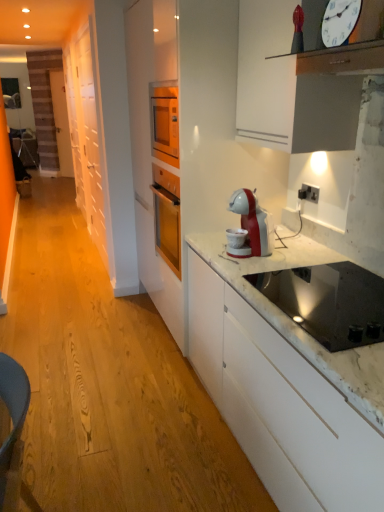
What do you see at coordinates (309, 193) in the screenshot? I see `white plastic electric outlet at upper right` at bounding box center [309, 193].

Measure the distance between point (341, 307) and camera.

Point (341, 307) and camera are 4.82 feet apart.

In the scene shown: In order to face black glass cooktop at lower right, should I rotate leftwards or rightwards?

Rotate your view right by about 19.422°.

This screenshot has width=384, height=512. I want to click on white matte cabinet at left, so click(x=86, y=134).

Are white matte cabinet at left and white plastic clock at upper right located far from each other?

Yes, white matte cabinet at left is far from white plastic clock at upper right.

Do you think white matte cabinet at left is within white plastic clock at upper right, or outside of it?

white matte cabinet at left cannot be found inside white plastic clock at upper right.

Considering the sizes of objects white matte cabinet at left and white plastic clock at upper right in the image provided, who is wider, white matte cabinet at left or white plastic clock at upper right?

Wider between the two is white matte cabinet at left.

Can you confirm if white matte cabinet at left is positioned to the right of white plastic clock at upper right?

No, white matte cabinet at left is not to the right of white plastic clock at upper right.

Is white plastic electric outlet at upper right at the back of white matte cabinet at left?

That's not correct — white matte cabinet at left is not looking away from white plastic electric outlet at upper right.

From a real-world perspective, does white matte cabinet at left stand above white plastic electric outlet at upper right?

Actually, white matte cabinet at left is physically below white plastic electric outlet at upper right in the real world.

Can you tell me how much white matte cabinet at left and white plastic electric outlet at upper right differ in facing direction?

The angular difference between white matte cabinet at left and white plastic electric outlet at upper right is 14.1 degrees.

From a real-world perspective, is white plastic electric outlet at upper right above or below black glass cooktop at lower right?

From a real-world perspective, white plastic electric outlet at upper right is physically above black glass cooktop at lower right.

Identify the location of electric outlet that is on the right side of black glass cooktop at lower right. (309, 193).

Considering the points (314, 194) and (284, 302), which point is behind, point (314, 194) or point (284, 302)?

Positioned behind is point (314, 194).

From the image's perspective, would you say white plastic clock at upper right is positioned over white plastic electric outlet at upper right?

Indeed, from the image's perspective, white plastic clock at upper right is shown above white plastic electric outlet at upper right.

Which is more to the right, white plastic clock at upper right or white plastic electric outlet at upper right?

Positioned to the right is white plastic electric outlet at upper right.

Considering the sizes of white plastic clock at upper right and white plastic electric outlet at upper right in the image, is white plastic clock at upper right wider or thinner than white plastic electric outlet at upper right?

In the image, white plastic clock at upper right appears to be more narrow than white plastic electric outlet at upper right.

Identify the location of clock that is above the white plastic electric outlet at upper right (from the image's perspective). (339, 21).

Is white matte cabinet at left not near black glass cooktop at lower right?

That's right, there is a large distance between white matte cabinet at left and black glass cooktop at lower right.

Is white matte cabinet at left oriented away from black glass cooktop at lower right?

white matte cabinet at left does not have its back to black glass cooktop at lower right.

Is white matte cabinet at left located outside black glass cooktop at lower right?

Yes, white matte cabinet at left is outside of black glass cooktop at lower right.

Who is smaller, white matte cabinet at left or black glass cooktop at lower right?

black glass cooktop at lower right is smaller.

Looking at this image, looking at their sizes, would you say white plastic electric outlet at upper right is wider or thinner than white plastic clock at upper right?

In the image, white plastic electric outlet at upper right appears to be wider than white plastic clock at upper right.

From a real-world perspective, who is located lower, white plastic electric outlet at upper right or white plastic clock at upper right?

white plastic electric outlet at upper right, from a real-world perspective.

Considering the relative positions of white plastic electric outlet at upper right and white plastic clock at upper right in the image provided, is white plastic electric outlet at upper right to the right of white plastic clock at upper right from the viewer's perspective?

Indeed, white plastic electric outlet at upper right is positioned on the right side of white plastic clock at upper right.

Can you confirm if black glass cooktop at lower right is smaller than white plastic electric outlet at upper right?

No.

Consider the image. Is black glass cooktop at lower right to the right of white plastic electric outlet at upper right from the viewer's perspective?

No.

Looking at this image, from the image's perspective, which one is positioned higher, black glass cooktop at lower right or white plastic electric outlet at upper right?

white plastic electric outlet at upper right, from the image's perspective.

Is white plastic electric outlet at upper right a part of black glass cooktop at lower right?

No, white plastic electric outlet at upper right is not surrounded by black glass cooktop at lower right.

I want to click on cabinetry that appears behind the white plastic clock at upper right, so click(86, 134).

Locate an element on the screen. Image resolution: width=384 pixels, height=512 pixels. cabinetry below the white plastic electric outlet at upper right (from a real-world perspective) is located at coordinates (86, 134).

Looking at the image, which one is located further to black glass cooktop at lower right, white matte cabinet at left or white plastic electric outlet at upper right?

white matte cabinet at left.

Which object lies further to the anchor point white plastic electric outlet at upper right, white matte cabinet at left or white plastic clock at upper right?

The object further to white plastic electric outlet at upper right is white matte cabinet at left.

Based on their spatial positions, is white plastic electric outlet at upper right or black glass cooktop at lower right further from white matte cabinet at left?

Based on the image, black glass cooktop at lower right appears to be further to white matte cabinet at left.

Which object lies nearer to the anchor point black glass cooktop at lower right, white plastic clock at upper right or white matte cabinet at left?

Among the two, white plastic clock at upper right is located nearer to black glass cooktop at lower right.

Estimate the real-world distances between objects in this image. Which object is closer to white plastic electric outlet at upper right, white plastic clock at upper right or black glass cooktop at lower right?

Based on the image, black glass cooktop at lower right appears to be nearer to white plastic electric outlet at upper right.

Which object lies further to the anchor point white plastic electric outlet at upper right, black glass cooktop at lower right or white plastic clock at upper right?

Among the two, white plastic clock at upper right is located further to white plastic electric outlet at upper right.

Which object lies further to the anchor point black glass cooktop at lower right, white plastic electric outlet at upper right or white plastic clock at upper right?

white plastic clock at upper right is positioned further to the anchor black glass cooktop at lower right.

Estimate the real-world distances between objects in this image. Which object is closer to white plastic clock at upper right, black glass cooktop at lower right or white plastic electric outlet at upper right?

Among the two, black glass cooktop at lower right is located nearer to white plastic clock at upper right.

What are the coordinates of `electric outlet between white plastic clock at upper right and white matte cabinet at left along the z-axis` in the screenshot? It's located at (309, 193).

Locate an element on the screen. kitchen appliance positioned between white plastic clock at upper right and white matte cabinet at left from near to far is located at coordinates (329, 302).

At what (x,y) coordinates should I click in order to perform the action: click on electric outlet positioned between black glass cooktop at lower right and white matte cabinet at left from near to far. Please return your answer as a coordinate pair (x, y). Image resolution: width=384 pixels, height=512 pixels. Looking at the image, I should click on (309, 193).

Identify the location of kitchen appliance between white plastic clock at upper right and white plastic electric outlet at upper right along the z-axis. The height and width of the screenshot is (512, 384). (329, 302).